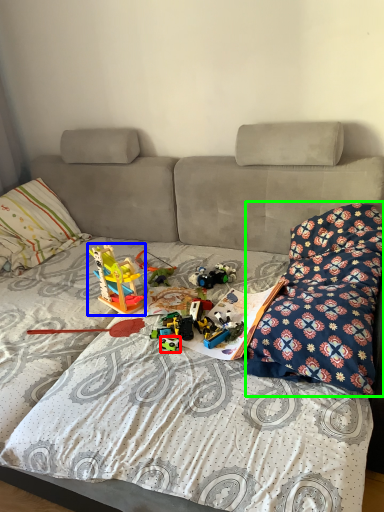
Question: Which object is positioned closest to toy (highlighted by a red box)? Select from toy (highlighted by a blue box) and blanket (highlighted by a green box).

Choices:
 (A) toy
 (B) blanket

Answer: (A)